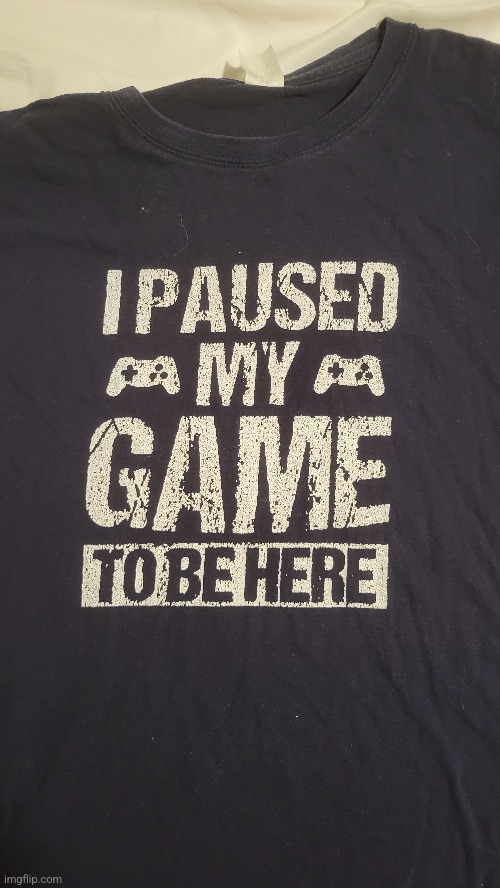
Locate an element on the screen. This screenshot has width=500, height=888. video game controller is located at coordinates (119, 370), (352, 369).